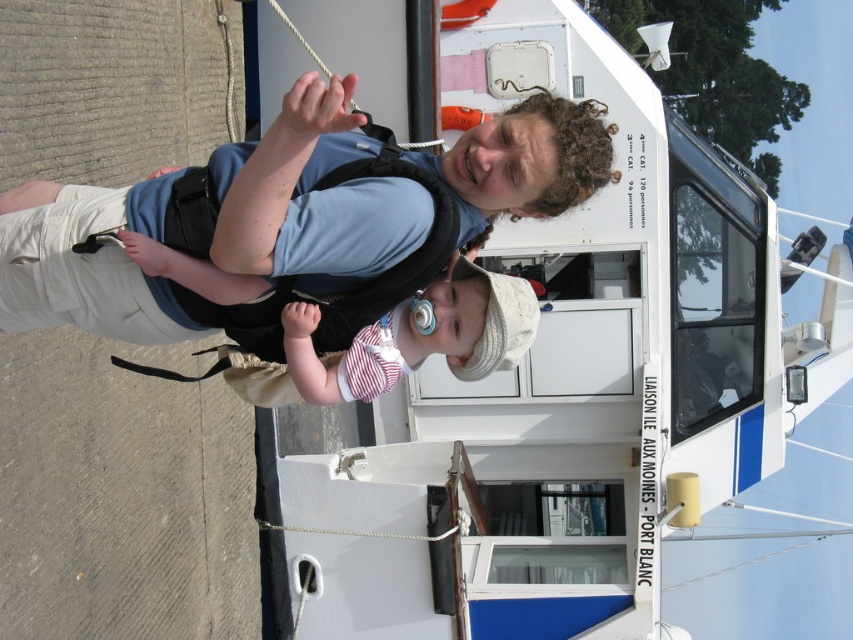
You are a photographer trying to capture a closeup of the baby in the carrier. You notice the blue fabric vest at center and the white cotton hat at center. Which item should you focus on to ensure the baby is centered in your shot?

You should focus on the white cotton hat at center because the blue fabric vest at center is to the left of it, so centering the hat would place the baby in the middle of the frame.

You are a photographer trying to capture a photo of the blue fabric vest at center and the boat behind them. The minimum distance required between the camera and the subject for clear focus is 10 feet. Will you be able to focus on both subjects clearly?

The blue fabric vest at center and the boat behind them are 9.75 feet apart. Since the minimum focus distance is 10 feet, the camera cannot focus on both subjects clearly at the same time because the distance between them is less than the required 10 feet.